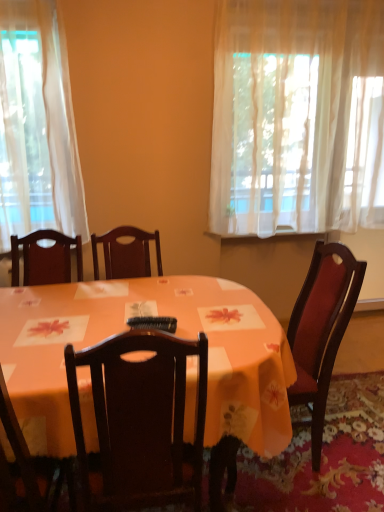
Identify the location of vacant space situated on the left part of black plastic remote control at center. (95, 328).